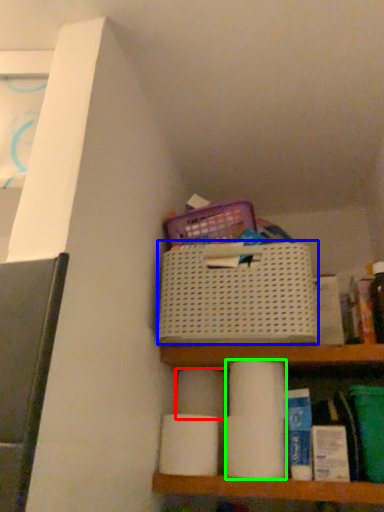
Question: Which object is positioned farthest from toilet paper (highlighted by a red box)? Select from basket (highlighted by a blue box) and toilet paper (highlighted by a green box).

Choices:
 (A) basket
 (B) toilet paper

Answer: (A)